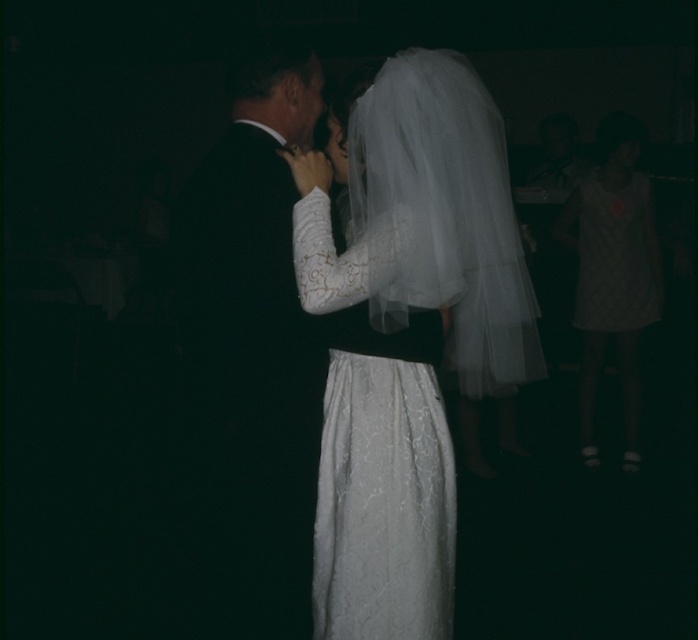
Measure the distance from matte black suit at center to white quilted dress at right.

matte black suit at center is 2.44 meters away from white quilted dress at right.

Does point (223, 348) come closer to viewer compared to point (630, 244)?

Yes.

Identify the location of matte black suit at center. The width and height of the screenshot is (698, 640). pyautogui.click(x=251, y=355).

Which is more to the right, white quilted dress at right or white quilted fabric dress at right?

Positioned to the right is white quilted fabric dress at right.

Is white quilted dress at right shorter than white quilted fabric dress at right?

In fact, white quilted dress at right may be taller than white quilted fabric dress at right.

Who is more forward, (588, 264) or (653, 269)?

Point (653, 269)

Locate an element on the screen. Image resolution: width=698 pixels, height=640 pixels. white quilted dress at right is located at coordinates (611, 273).

Measure the distance between matte black suit at center and white quilted fabric dress at right.

The distance of matte black suit at center from white quilted fabric dress at right is 2.46 meters.

Which is more to the left, matte black suit at center or white quilted fabric dress at right?

Positioned to the left is matte black suit at center.

The height and width of the screenshot is (640, 698). In order to click on matte black suit at center in this screenshot , I will do `click(251, 355)`.

Identify the location of matte black suit at center. (x=251, y=355).